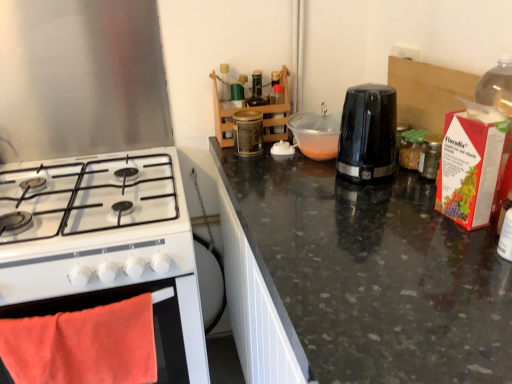
Question: From the image's perspective, is white glossy gas stove at left, which is the second kitchen appliance in right-to-left order, below metallic gold canister at center?

Choices:
 (A) yes
 (B) no

Answer: (A)

Question: Is white glossy gas stove at left, which appears as the 1th kitchen appliance when viewed from the left, not within metallic gold canister at center?

Choices:
 (A) no
 (B) yes

Answer: (B)

Question: From a real-world perspective, is white glossy gas stove at left, which is the second kitchen appliance in right-to-left order, on metallic gold canister at center?

Choices:
 (A) yes
 (B) no

Answer: (B)

Question: From a real-world perspective, is white glossy gas stove at left, which is the second kitchen appliance in right-to-left order, located beneath metallic gold canister at center?

Choices:
 (A) no
 (B) yes

Answer: (B)

Question: Considering the relative sizes of white glossy gas stove at left, which is the second kitchen appliance in right-to-left order, and metallic gold canister at center in the image provided, is white glossy gas stove at left, which is the second kitchen appliance in right-to-left order, bigger than metallic gold canister at center?

Choices:
 (A) no
 (B) yes

Answer: (B)

Question: Is white glossy gas stove at left, which is the second kitchen appliance in right-to-left order, positioned in front of metallic gold canister at center?

Choices:
 (A) yes
 (B) no

Answer: (A)

Question: Does orange fabric oven at lower left appear on the right side of white glossy gas stove at left, which is the second kitchen appliance in right-to-left order?

Choices:
 (A) yes
 (B) no

Answer: (A)

Question: Is orange fabric oven at lower left further to the viewer compared to white glossy gas stove at left, which is the second kitchen appliance in right-to-left order?

Choices:
 (A) no
 (B) yes

Answer: (B)

Question: Can you confirm if orange fabric oven at lower left is positioned to the left of white glossy gas stove at left, which is the second kitchen appliance in right-to-left order?

Choices:
 (A) no
 (B) yes

Answer: (A)

Question: Considering the relative sizes of orange fabric oven at lower left and white glossy gas stove at left, which is the second kitchen appliance in right-to-left order, in the image provided, is orange fabric oven at lower left wider than white glossy gas stove at left, which is the second kitchen appliance in right-to-left order,?

Choices:
 (A) yes
 (B) no

Answer: (B)

Question: From a real-world perspective, is orange fabric oven at lower left beneath white glossy gas stove at left, which appears as the 1th kitchen appliance when viewed from the left?

Choices:
 (A) yes
 (B) no

Answer: (A)

Question: Does orange fabric oven at lower left have a lesser height compared to white glossy gas stove at left, which is the second kitchen appliance in right-to-left order?

Choices:
 (A) no
 (B) yes

Answer: (A)

Question: Is black plastic toaster at center, arranged as the second kitchen appliance when viewed from the left, taller than white glossy gas stove at left, which appears as the 1th kitchen appliance when viewed from the left?

Choices:
 (A) yes
 (B) no

Answer: (A)